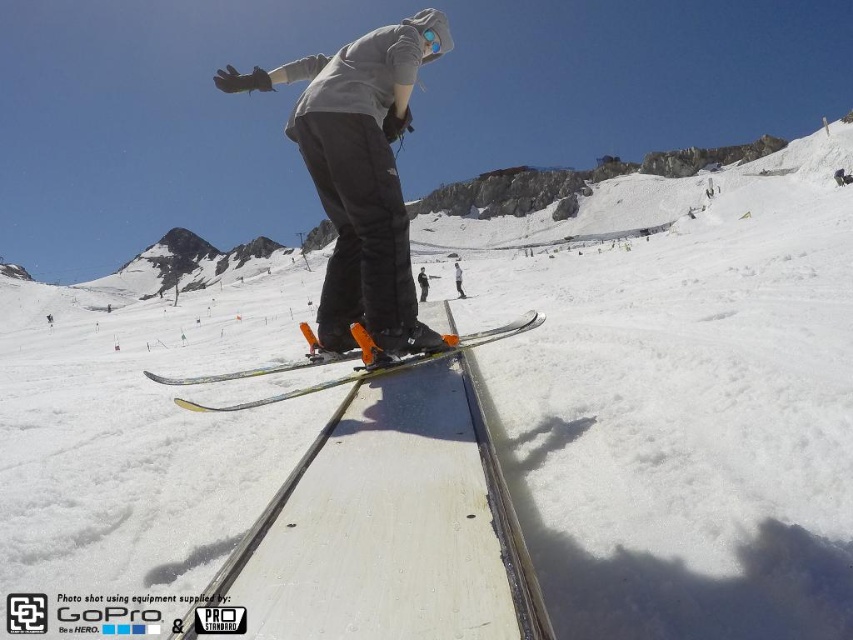
Question: Among these points, which one is farthest from the camera?

Choices:
 (A) [x=503, y=326]
 (B) [x=308, y=84]
 (C) [x=421, y=269]

Answer: (C)

Question: Does matte gray hoodie at center lie behind matte black skis at center?

Choices:
 (A) no
 (B) yes

Answer: (A)

Question: Can you confirm if matte gray hoodie at center is positioned to the right of shiny metallic skis at center?

Choices:
 (A) no
 (B) yes

Answer: (A)

Question: Which of these objects is positioned closest to the matte gray hoodie at center?

Choices:
 (A) matte black skis at center
 (B) shiny metallic skis at center
 (C) white matte snowboarder at center

Answer: (B)

Question: Is matte gray hoodie at center above matte black skis at center?

Choices:
 (A) no
 (B) yes

Answer: (B)

Question: Which point appears closest to the camera in this image?

Choices:
 (A) (355, 250)
 (B) (456, 266)
 (C) (426, 292)

Answer: (A)